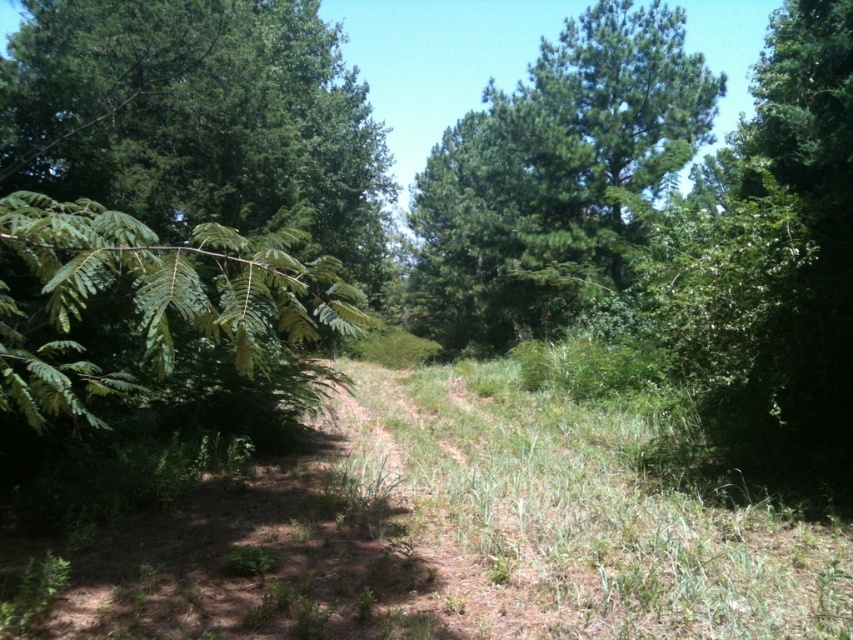
Looking at this image, does green leafy branch at left have a greater height compared to green leafy tree at upper center?

Indeed, green leafy branch at left has a greater height compared to green leafy tree at upper center.

Does point (10, 172) come in front of point (553, 272)?

Yes, point (10, 172) is closer to viewer.

Who is more distant from viewer, (292, 200) or (456, 150)?

The point (456, 150) is behind.

Image resolution: width=853 pixels, height=640 pixels. I want to click on green leafy branch at left, so click(x=198, y=122).